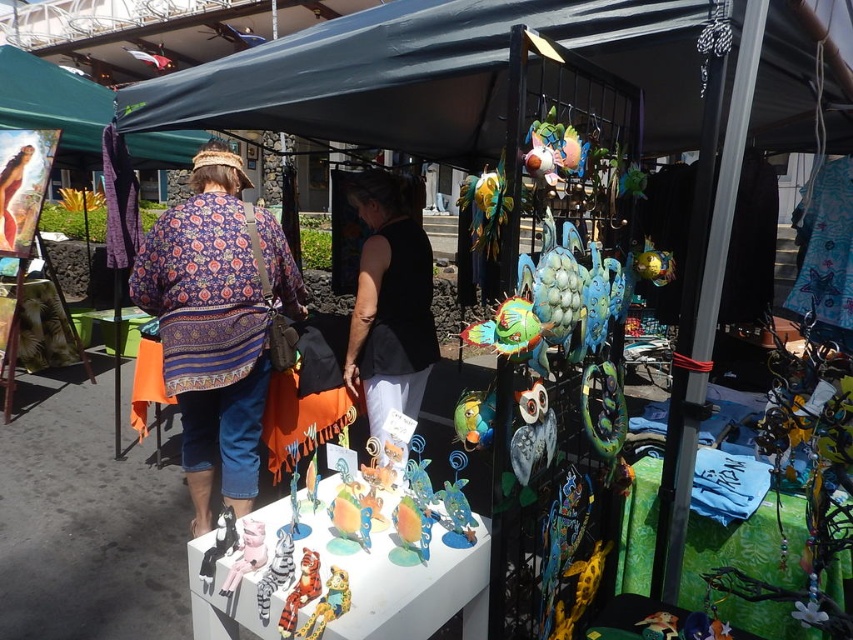
Can you confirm if patterned fabric shirt at center is positioned below black matte tank top at center?

Correct, patterned fabric shirt at center is located below black matte tank top at center.

Is patterned fabric shirt at center wider than black matte tank top at center?

Correct, the width of patterned fabric shirt at center exceeds that of black matte tank top at center.

Who is more distant from viewer, (x=190, y=426) or (x=350, y=321)?

The point (x=350, y=321) is more distant.

Find the location of a particular element. Image resolution: width=853 pixels, height=640 pixels. patterned fabric shirt at center is located at coordinates (215, 323).

Is point (122, 118) more distant than point (352, 200)?

Yes, point (122, 118) is farther from viewer.

This screenshot has height=640, width=853. What do you see at coordinates (430, 74) in the screenshot?
I see `dark green fabric canopy at upper center` at bounding box center [430, 74].

Identify the location of dark green fabric canopy at upper center. This screenshot has height=640, width=853. (430, 74).

Based on the photo, does dark green fabric canopy at upper center appear over patterned fabric shirt at center?

Correct, dark green fabric canopy at upper center is located above patterned fabric shirt at center.

Who is more forward, (810, 58) or (234, 316)?

Point (810, 58) is in front.

You are a GUI agent. You are given a task and a screenshot of the screen. Output one action in this format:
    pyautogui.click(x=<x>, y=<y>)
    Task: Click on the dark green fabric canopy at upper center
    The image size is (853, 640).
    Given the screenshot: What is the action you would take?
    pyautogui.click(x=430, y=74)